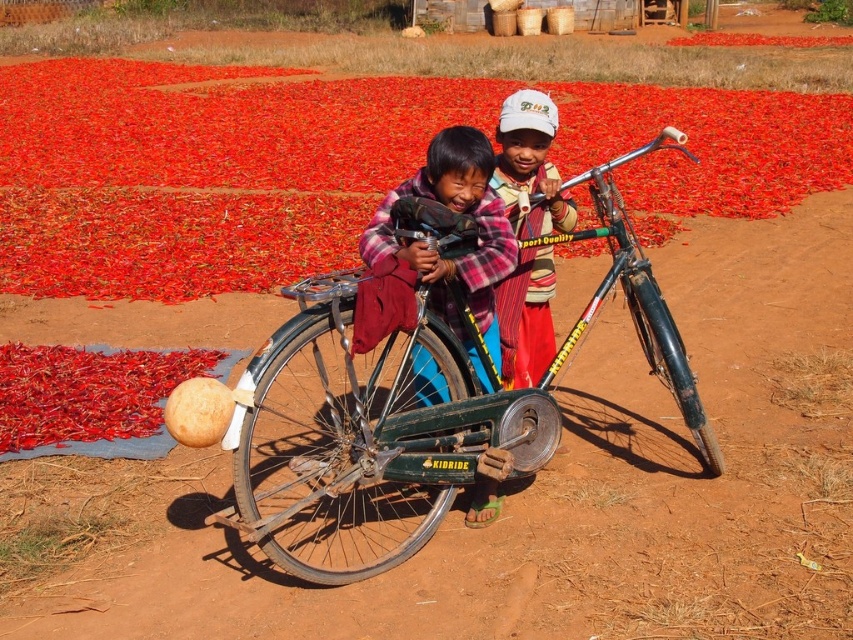
Question: Which of the following is the farthest from the observer?

Choices:
 (A) (492, 280)
 (B) (573, 214)

Answer: (B)

Question: Which of the following is the closest to the observer?

Choices:
 (A) (340, 291)
 (B) (413, 358)
 (C) (508, 115)

Answer: (A)

Question: Does green matte bicycle at center appear on the left side of striped fabric shirt at center?

Choices:
 (A) no
 (B) yes

Answer: (B)

Question: Observing the image, what is the correct spatial positioning of green matte bicycle at center in reference to striped fabric shirt at center?

Choices:
 (A) below
 (B) above

Answer: (A)

Question: Which point is farther to the camera?

Choices:
 (A) green matte bicycle at center
 (B) plaid fabric shirt at center
 (C) striped fabric shirt at center

Answer: (C)

Question: Can you confirm if green matte bicycle at center is positioned to the left of plaid fabric shirt at center?

Choices:
 (A) yes
 (B) no

Answer: (B)